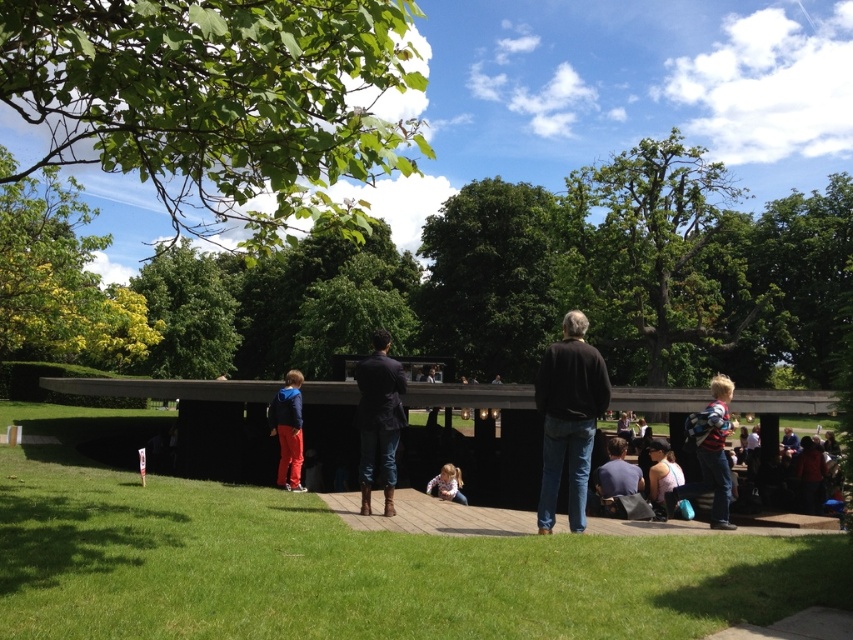
Who is positioned more to the left, dark brown leather boots at center or light pink fabric at center?

From the viewer's perspective, dark brown leather boots at center appears more on the left side.

How much distance is there between dark brown leather boots at center and light pink fabric at center?

dark brown leather boots at center and light pink fabric at center are 3.35 meters apart.

Which is in front, point (392, 419) or point (453, 486)?

Point (392, 419)

Image resolution: width=853 pixels, height=640 pixels. I want to click on dark brown leather boots at center, so click(x=379, y=419).

Between dark brown leather boots at center and matte blue jacket at center, which one has less height?

With less height is dark brown leather boots at center.

Is dark brown leather boots at center closer to the viewer compared to matte blue jacket at center?

Yes, it is.

Which is in front, point (368, 454) or point (300, 412)?

Positioned in front is point (368, 454).

At what (x,y) coordinates should I click in order to perform the action: click on dark brown leather boots at center. Please return your answer as a coordinate pair (x, y). The image size is (853, 640). Looking at the image, I should click on (379, 419).

Can you confirm if matte blue jacket at center is wider than dark blue shirt at center?

Indeed, matte blue jacket at center has a greater width compared to dark blue shirt at center.

Between point (291, 397) and point (614, 490), which one is positioned behind?

The point (291, 397) is more distant.

The height and width of the screenshot is (640, 853). What are the coordinates of `matte blue jacket at center` in the screenshot? It's located at (288, 429).